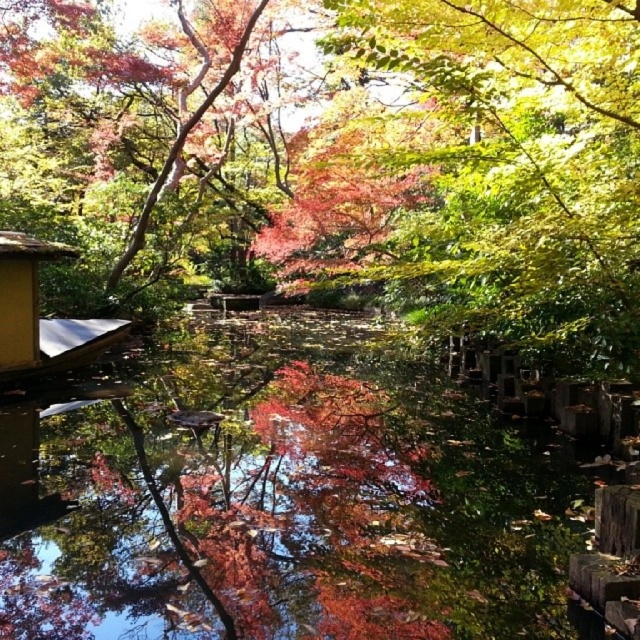
Which is in front, point (150, 145) or point (38, 371)?

Point (38, 371) is more forward.

Is shiny red leaves at upper center to the left of yellow wood hut at lower left from the viewer's perspective?

In fact, shiny red leaves at upper center is to the right of yellow wood hut at lower left.

Between point (608, 58) and point (61, 248), which one is positioned in front?

Point (608, 58)

Locate an element on the screen. shiny red leaves at upper center is located at coordinates [349, 157].

Measure the distance between point (10, 13) and camera.

A distance of 16.62 meters exists between point (10, 13) and camera.

Can you confirm if shiny red leaves at upper center is shorter than transparent water at center?

Incorrect, shiny red leaves at upper center's height does not fall short of transparent water at center's.

Between point (506, 230) and point (132, 474), which one is positioned behind?

Point (506, 230)

Where is `shiny red leaves at upper center`? This screenshot has width=640, height=640. shiny red leaves at upper center is located at coordinates (349, 157).

Is transparent water at center further to camera compared to yellow wood hut at lower left?

No, it is not.

Does transparent water at center appear on the right side of yellow wood hut at lower left?

Correct, you'll find transparent water at center to the right of yellow wood hut at lower left.

Does point (211, 548) lie in front of point (1, 328)?

Yes.

Where is `transparent water at center`? This screenshot has width=640, height=640. transparent water at center is located at coordinates (316, 499).